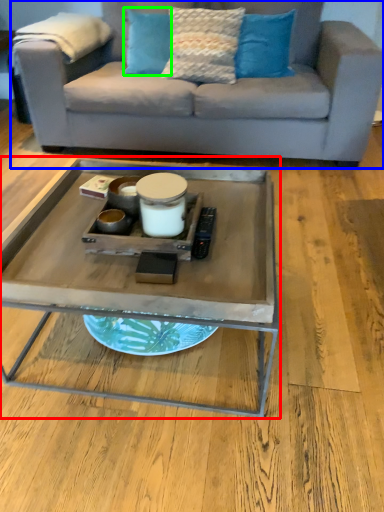
Question: Considering the real-world distances, which object is closest to coffee table (highlighted by a red box)? studio couch (highlighted by a blue box) or pillow (highlighted by a green box).

Choices:
 (A) studio couch
 (B) pillow

Answer: (A)